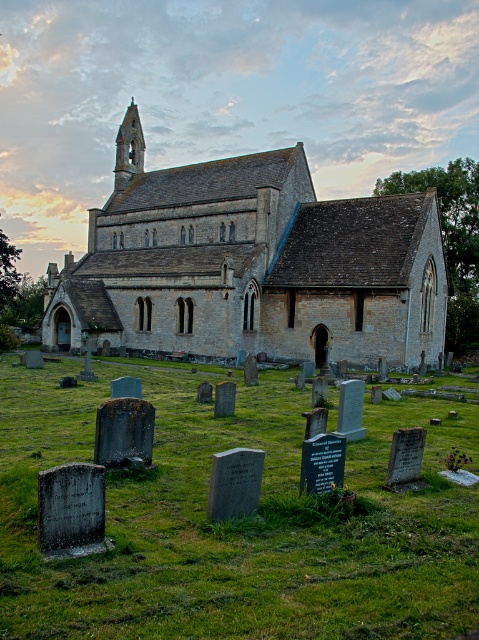
You are standing in the graveyard in front of the stone church at center and want to take a photo of the smooth stone spire at upper left. Which direction should you face to capture the spire in your camera view?

You should face to the left of the stone church at center to capture the smooth stone spire at upper left in your camera view since the stone church at center is positioned to the right of the smooth stone spire at upper left.

You are a groundskeeper tasked with mowing the green mossy grass at lower center and maintaining the stone church at center. Which area requires more space to work on?

The stone church at center requires more space to work on because the green mossy grass at lower center occupies less space than the stone church at center.

You are standing in front of the church and notice the green mossy grass at lower center and the smooth stone spire at upper left. Which object is located to the right of the other?

The green mossy grass at lower center is positioned on the right side of smooth stone spire at upper left.